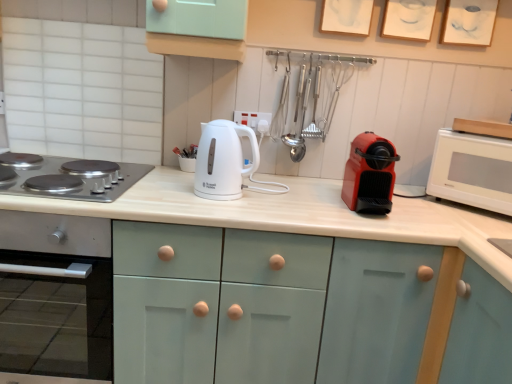
You are a GUI agent. You are given a task and a screenshot of the screen. Output one action in this format:
    pyautogui.click(x=<x>, y=<y>)
    Task: Click on the free location in front of white glossy electric kettle at center, which appears as the 2th kitchen appliance when viewed from the right
    
    Given the screenshot: What is the action you would take?
    pyautogui.click(x=219, y=211)